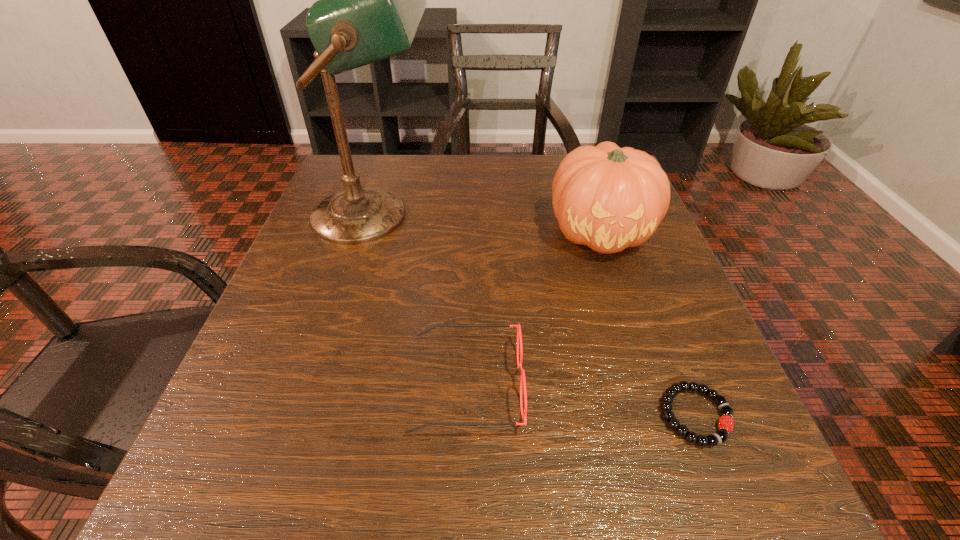
Locate an element on the screen. free space that satisfies the following two spatial constraints: 1. on the carved face of the second tallest object; 2. on the right side of the shortest object is located at coordinates (661, 415).